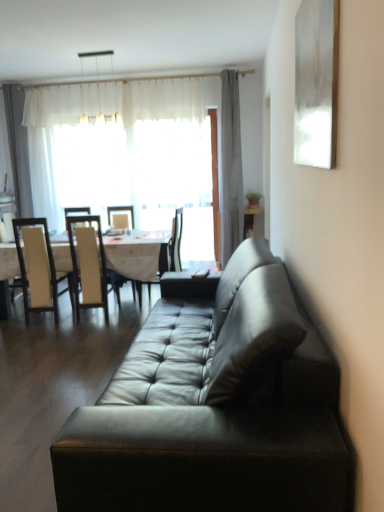
Question: From a real-world perspective, is white leather chair at left, marked as the 2th chair in a right-to-left arrangement, positioned above or below white glossy table at center?

Choices:
 (A) below
 (B) above

Answer: (B)

Question: Is point (96, 300) positioned closer to the camera than point (142, 231)?

Choices:
 (A) farther
 (B) closer

Answer: (B)

Question: Which is farther from the white leather chair at left, which appears as the 1th chair when viewed from the left?

Choices:
 (A) white sheer curtain at upper left
 (B) white glossy table at center
 (C) leather couch at center
 (D) gray fabric curtain at upper center
 (E) black leather chair at center, which ranks as the 3th chair in left-to-right order

Answer: (C)

Question: Considering the real-world distances, which object is closest to the white glossy table at center?

Choices:
 (A) leather couch at center
 (B) black leather chair at center, acting as the first chair starting from the right
 (C) white sheer curtain at upper left
 (D) white leather chair at left, marked as the 2th chair in a right-to-left arrangement
 (E) white leather chair at left, which appears as the 1th chair when viewed from the left

Answer: (B)